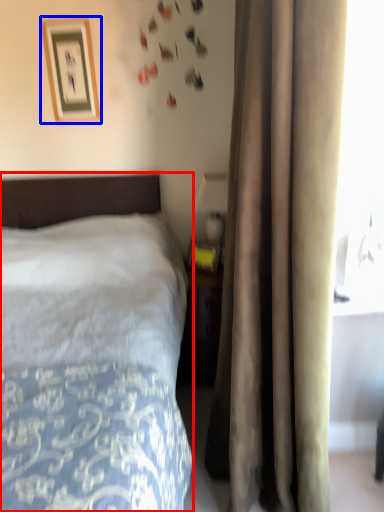
Question: Among these objects, which one is farthest to the camera, bed (highlighted by a red box) or picture frame (highlighted by a blue box)?

Choices:
 (A) bed
 (B) picture frame

Answer: (B)